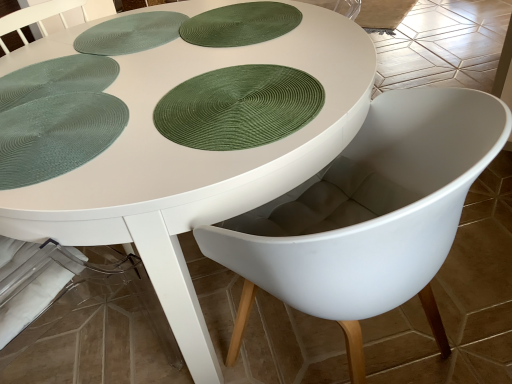
Find the location of a particular element. This screenshot has width=512, height=384. free space between green textured placemat at upper left and green textured placemat at upper left, the 2th paper plate when ordered from top to bottom is located at coordinates (103, 60).